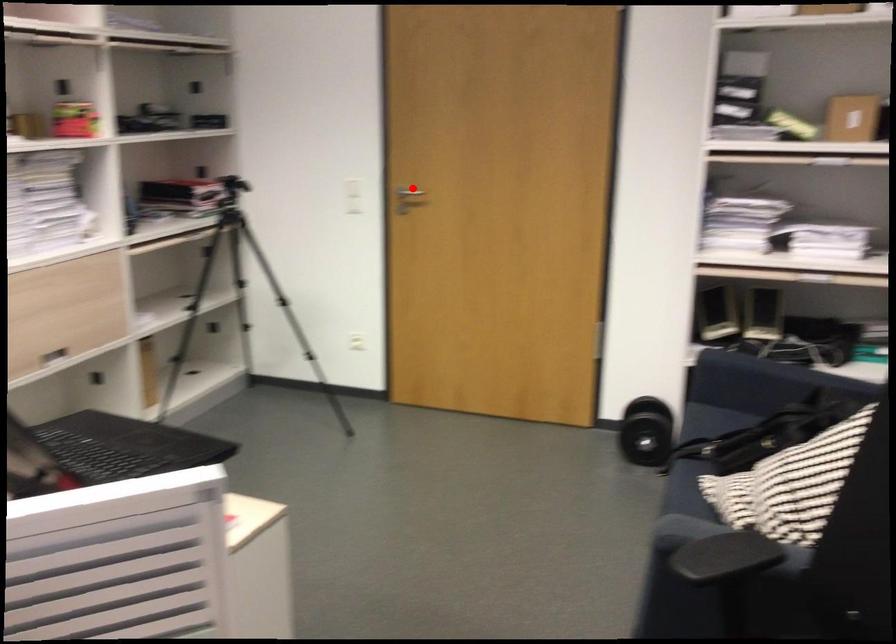
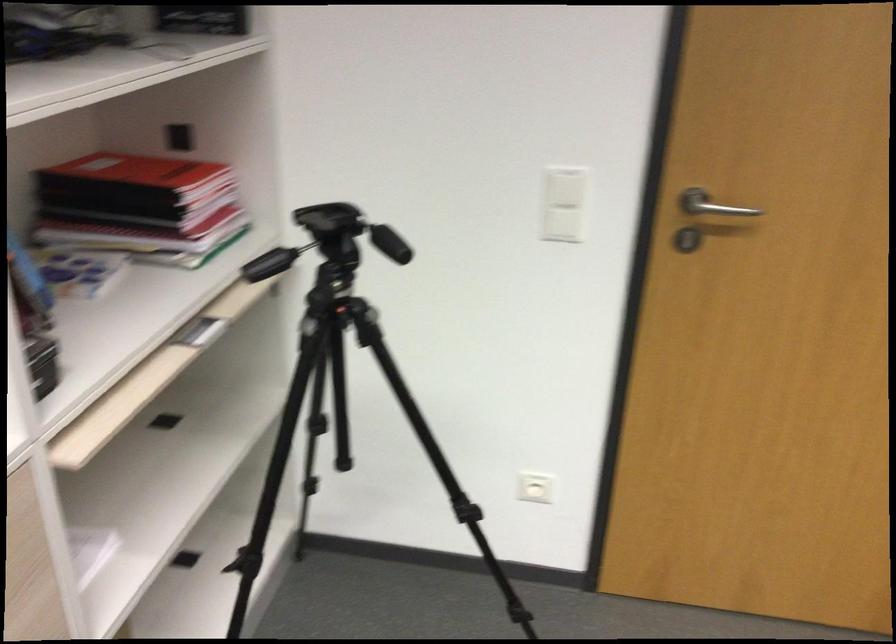
Question: I am providing you with two images of the same scene from different viewpoints. Image1 has a red point marked. In image2, the corresponding 3D location appears at what relative position? Reply with the corresponding letter.

Choices:
 (A) Closer
 (B) Farther

Answer: (A)